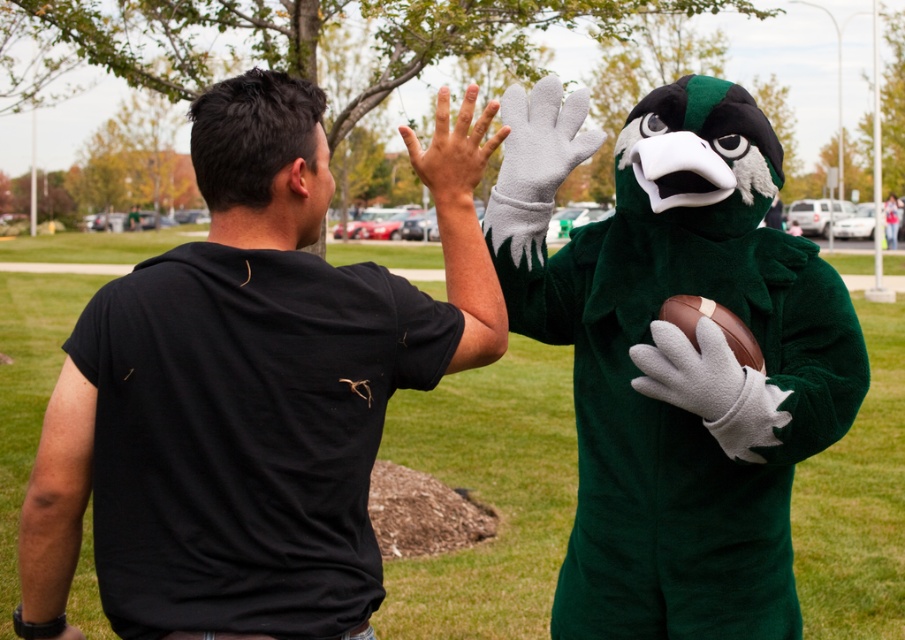
You are a photographer trying to capture the perfect shot of the white fleece glove at center and the smooth skin hand at center. Since you want to emphasize the size difference between them, which object should you zoom in on more to highlight their size discrepancy?

To emphasize the size difference between the white fleece glove at center and the smooth skin hand at center, you should zoom in more on the white fleece glove at center since it is smaller than the smooth skin hand at center, making its size more noticeable against the larger hand.

You are a photographer trying to capture the interaction between the man in the black T shirt and the mascot with the football. You want to place your camera exactly at the point marked by the coordinate point (543,140). What object will your camera be positioned directly in front of?

The point (543,140) marks the white fleece glove at center, so placing the camera there would position it directly in front of the white fleece glove at center.

Based on the photo, you are a photographer at the scene. You need to capture a closeup of both the white fleece glove at center and the smooth skin hand at center. Which object is easier to fit into the frame without zooming in further?

The white fleece glove at center is easier to fit into the frame without zooming in further because it is thinner than the smooth skin hand at center.